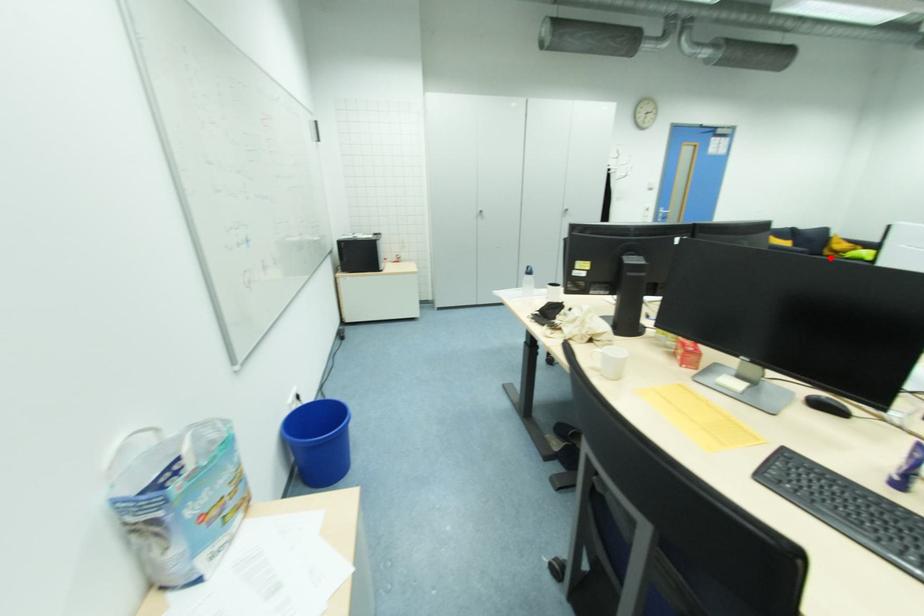
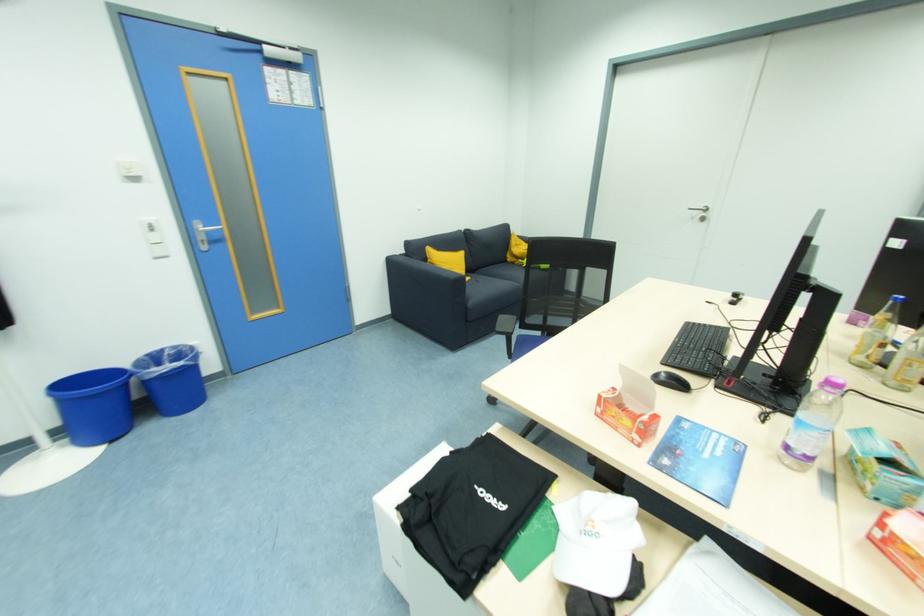
Locate, in the second image, the point that corresponds to the highlighted location in the first image.

(516, 265)